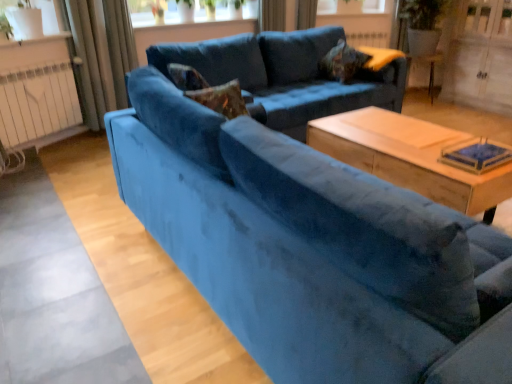
Question: From the image's perspective, is velvet blue curtain at upper center, which is counted as the 1th curtain, starting from the right, located beneath white wood screen door at upper right?

Choices:
 (A) yes
 (B) no

Answer: (B)

Question: From a real-world perspective, does velvet blue curtain at upper center, which is counted as the 1th curtain, starting from the right, stand above white wood screen door at upper right?

Choices:
 (A) yes
 (B) no

Answer: (A)

Question: Considering the relative sizes of velvet blue curtain at upper center, the 3th curtain positioned from the left, and white wood screen door at upper right in the image provided, is velvet blue curtain at upper center, the 3th curtain positioned from the left, bigger than white wood screen door at upper right?

Choices:
 (A) no
 (B) yes

Answer: (A)

Question: Can you confirm if velvet blue curtain at upper center, which is counted as the 1th curtain, starting from the right, is smaller than white wood screen door at upper right?

Choices:
 (A) no
 (B) yes

Answer: (B)

Question: Is velvet blue curtain at upper center, the 3th curtain positioned from the left, to the right of white wood screen door at upper right from the viewer's perspective?

Choices:
 (A) no
 (B) yes

Answer: (A)

Question: Is point (347, 107) closer or farther from the camera than point (361, 160)?

Choices:
 (A) farther
 (B) closer

Answer: (A)

Question: From the image's perspective, is velvet blue couch at center, placed as the first studio couch when sorted from back to front, located above or below wooden coffee table at center?

Choices:
 (A) above
 (B) below

Answer: (A)

Question: Is velvet blue couch at center, placed as the first studio couch when sorted from back to front, taller or shorter than wooden coffee table at center?

Choices:
 (A) tall
 (B) short

Answer: (A)

Question: Considering the positions of velvet blue couch at center, the 2th studio couch positioned from the front, and wooden coffee table at center in the image, is velvet blue couch at center, the 2th studio couch positioned from the front, wider or thinner than wooden coffee table at center?

Choices:
 (A) wide
 (B) thin

Answer: (A)

Question: Considering the positions of velvet textured pillow at upper center and wooden coffee table at center in the image, is velvet textured pillow at upper center taller or shorter than wooden coffee table at center?

Choices:
 (A) short
 (B) tall

Answer: (A)

Question: Is point (348, 59) positioned closer to the camera than point (374, 170)?

Choices:
 (A) farther
 (B) closer

Answer: (A)

Question: From a real-world perspective, is velvet textured pillow at upper center positioned above or below wooden coffee table at center?

Choices:
 (A) below
 (B) above

Answer: (B)

Question: Considering their positions, is velvet textured pillow at upper center located in front of or behind wooden coffee table at center?

Choices:
 (A) front
 (B) behind

Answer: (B)

Question: Do you think white matte radiator at left is within velvet curtain at upper center, which is counted as the second curtain, starting from the left, or outside of it?

Choices:
 (A) outside
 (B) inside

Answer: (A)

Question: Looking at the image, does white matte radiator at left seem bigger or smaller compared to velvet curtain at upper center, which is counted as the second curtain, starting from the left?

Choices:
 (A) small
 (B) big

Answer: (A)